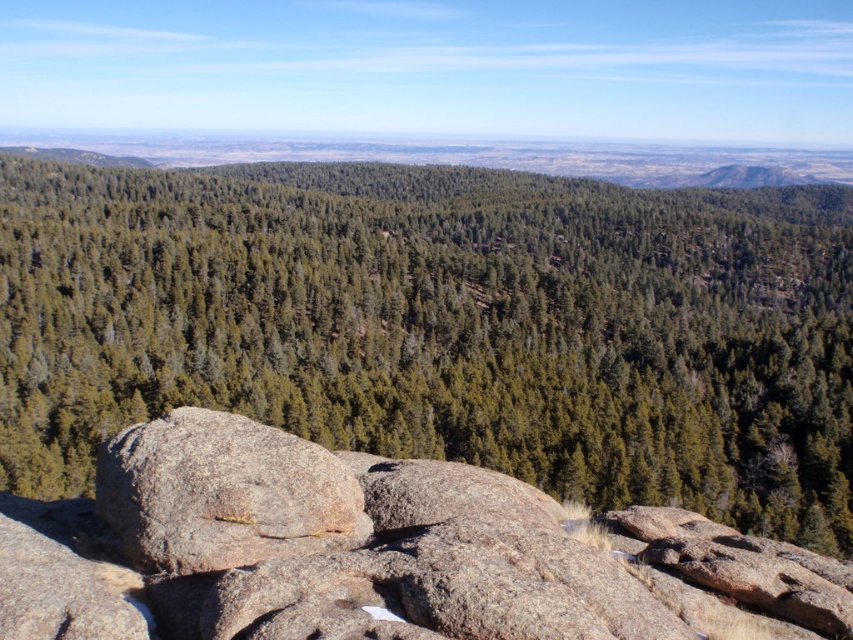
Question: Is gray granite rock at center bigger than gray rough boulder at center?

Choices:
 (A) no
 (B) yes

Answer: (B)

Question: Which object is positioned farthest from the gray granite rock at center?

Choices:
 (A) gray rough boulder at center
 (B) green matte forest at center

Answer: (B)

Question: Is green matte forest at center closer to the viewer compared to gray granite rock at center?

Choices:
 (A) yes
 (B) no

Answer: (B)

Question: Which object is closer to the camera taking this photo?

Choices:
 (A) green matte forest at center
 (B) gray rough boulder at center

Answer: (B)

Question: Which point is closer to the camera?

Choices:
 (A) pyautogui.click(x=276, y=276)
 (B) pyautogui.click(x=183, y=456)

Answer: (B)

Question: Does gray granite rock at center have a lesser width compared to gray rough boulder at center?

Choices:
 (A) no
 (B) yes

Answer: (A)